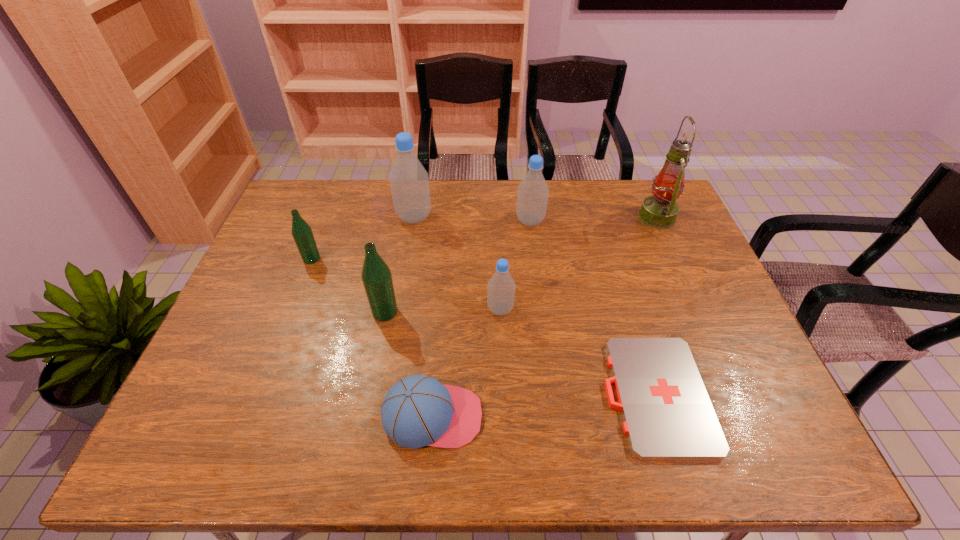
You are a GUI agent. You are given a task and a screenshot of the screen. Output one action in this format:
    pyautogui.click(x=<x>, y=<y>)
    Task: Click on the free space located 0.170m on the left of the second gray bottle from right to left
    The height and width of the screenshot is (540, 960).
    Given the screenshot: What is the action you would take?
    pyautogui.click(x=424, y=309)

Where is `free location located on the front of the smaller green bottle`? free location located on the front of the smaller green bottle is located at coordinates (290, 314).

This screenshot has width=960, height=540. Identify the location of free space located 0.150m on the front-facing side of the seventh tallest object. (549, 416).

Image resolution: width=960 pixels, height=540 pixels. What are the coordinates of `vacant area located 0.070m on handle side the gray first-aid kit` in the screenshot? It's located at (576, 395).

Find the location of a particular element. This screenshot has height=540, width=960. free space located on handle side the gray first-aid kit is located at coordinates (550, 395).

Locate an element on the screen. The height and width of the screenshot is (540, 960). vacant space located on handle side the gray first-aid kit is located at coordinates (546, 395).

Find the location of `oil lamp located at the far edge`. oil lamp located at the far edge is located at coordinates (660, 210).

Where is `baseball cap located in the near edge section of the desktop`? Image resolution: width=960 pixels, height=540 pixels. baseball cap located in the near edge section of the desktop is located at coordinates (418, 411).

Where is `the first-aid kit present at the near edge`? the first-aid kit present at the near edge is located at coordinates (667, 413).

Where is `object located in the left edge section of the desktop`? object located in the left edge section of the desktop is located at coordinates (302, 233).